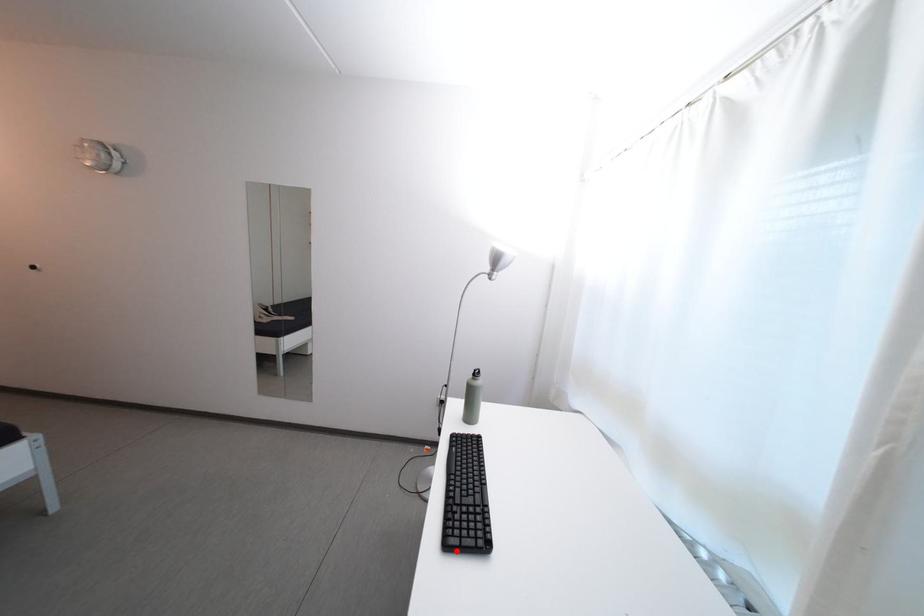
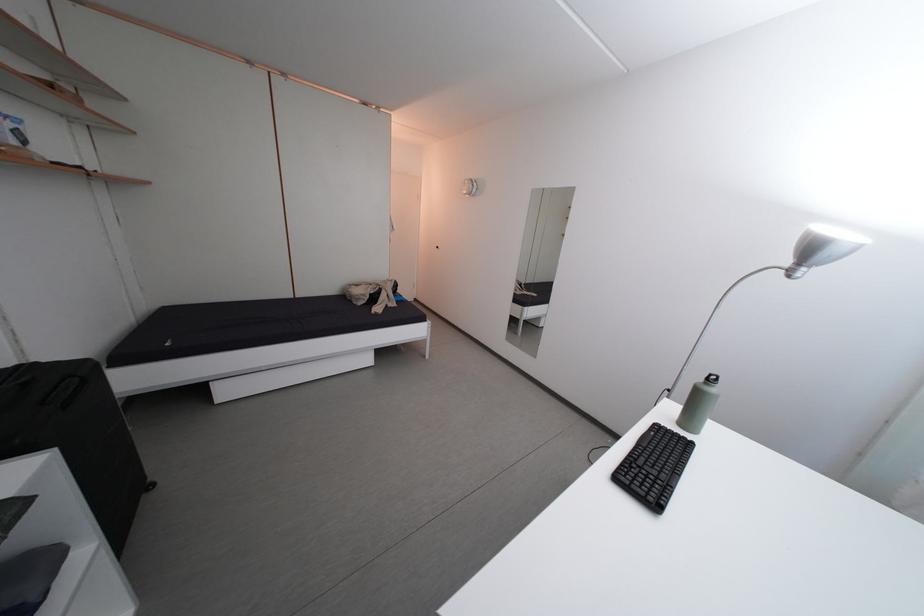
In the second image, find the point that corresponds to the highlighted location in the first image.

(626, 485)